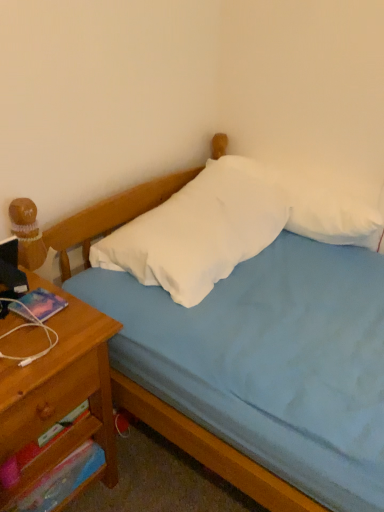
Question: From the image's perspective, is white soft pillow at upper right, the 1th pillow when ordered from right to left, positioned above or below wooden drawer at left, the second drawer when ordered from bottom to top?

Choices:
 (A) above
 (B) below

Answer: (A)

Question: Considering the positions of white soft pillow at upper right, acting as the 2th pillow starting from the left, and wooden drawer at left, the second drawer when ordered from bottom to top, in the image, is white soft pillow at upper right, acting as the 2th pillow starting from the left, taller or shorter than wooden drawer at left, the second drawer when ordered from bottom to top,?

Choices:
 (A) tall
 (B) short

Answer: (A)

Question: Which is farther from the light blue fabric bed at center?

Choices:
 (A) wooden nightstand at left
 (B) wooden drawer at left, acting as the first drawer starting from the top
 (C) white soft pillow at upper right, the 1th pillow when ordered from right to left
 (D) white soft pillow at center, the 1th pillow viewed from the left
 (E) wooden drawer at lower left, acting as the first drawer starting from the bottom

Answer: (E)

Question: Based on their relative distances, which object is nearer to the wooden drawer at left, the second drawer when ordered from bottom to top?

Choices:
 (A) white soft pillow at upper right, the 1th pillow when ordered from right to left
 (B) white soft pillow at center, which is the second pillow from right to left
 (C) light blue fabric bed at center
 (D) wooden drawer at lower left, which is the second drawer in top-to-bottom order
 (E) wooden nightstand at left

Answer: (E)